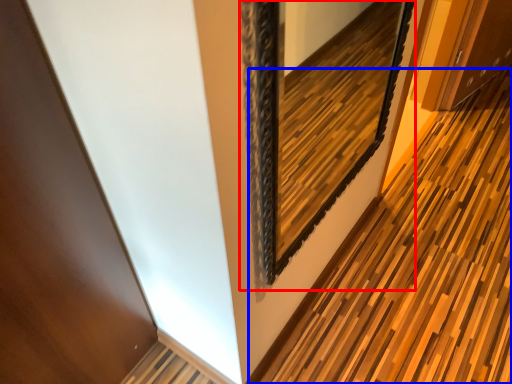
Question: Which of the following is the closest to the observer, picture frame (highlighted by a red box) or path (highlighted by a blue box)?

Choices:
 (A) picture frame
 (B) path

Answer: (A)